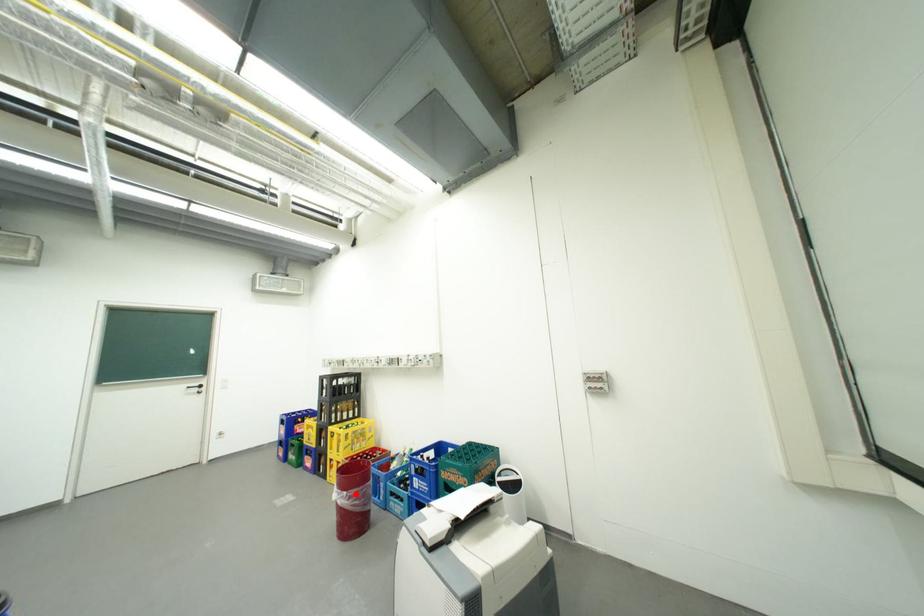
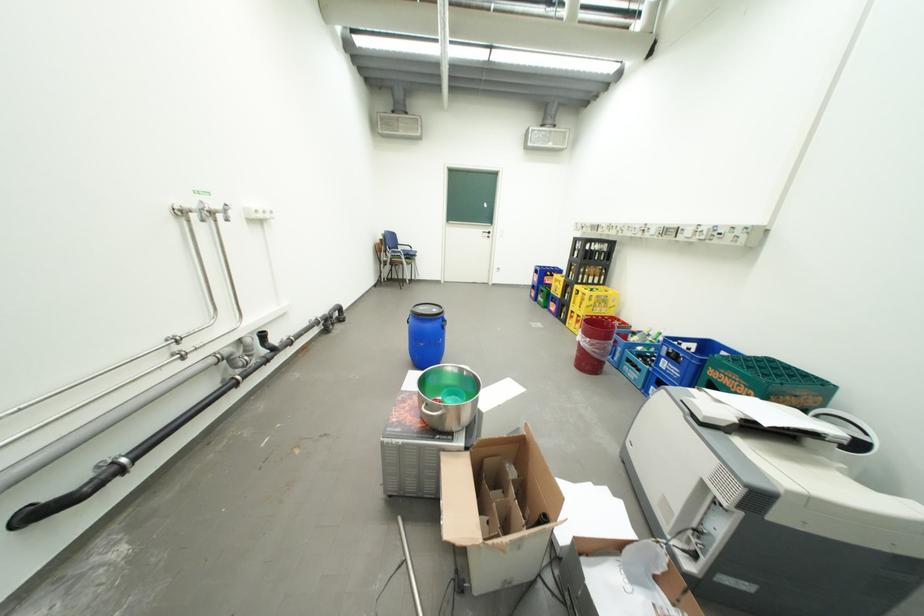
Question: I am providing you with two images of the same scene from different viewpoints. Given a red point in image1, look at the same physical point in image2. Is it:

Choices:
 (A) Closer to the viewpoint
 (B) Farther from the viewpoint

Answer: (A)